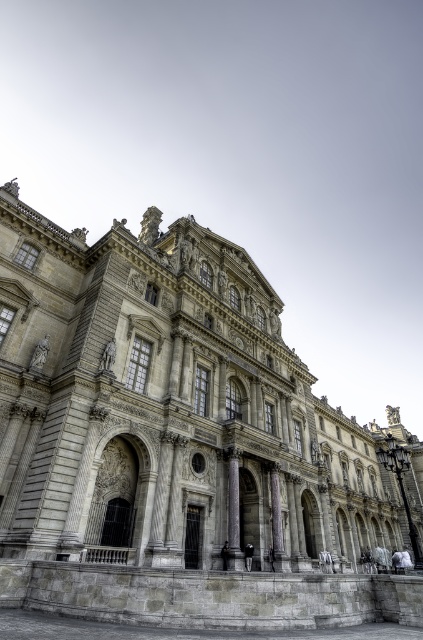
Who is taller, smooth gray stone pillar at center or gray stone pillar at center?

smooth gray stone pillar at center is taller.

What do you see at coordinates (233, 500) in the screenshot? The height and width of the screenshot is (640, 423). I see `smooth gray stone pillar at center` at bounding box center [233, 500].

Image resolution: width=423 pixels, height=640 pixels. In order to click on smooth gray stone pillar at center in this screenshot , I will do `click(233, 500)`.

Based on the photo, which of these two, gray stone palace at center or smooth gray stone pillar at center, stands shorter?

Standing shorter between the two is smooth gray stone pillar at center.

Is gray stone palace at center bigger than smooth gray stone pillar at center?

Yes, gray stone palace at center is bigger than smooth gray stone pillar at center.

Identify the location of gray stone palace at center. This screenshot has width=423, height=640. (178, 438).

Which is more to the left, gray stone palace at center or gray stone pillar at center?

Positioned to the left is gray stone pillar at center.

Identify the location of gray stone palace at center. pyautogui.click(x=178, y=438).

Who is more distant from viewer, [241,308] or [275,502]?

The point [241,308] is more distant.

What are the coordinates of `gray stone palace at center` in the screenshot? It's located at (178, 438).